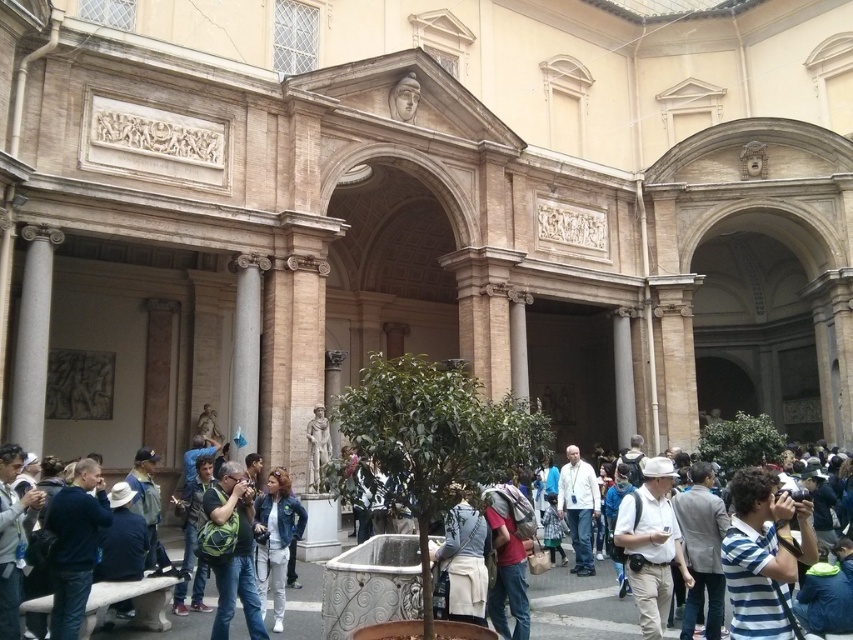
You are standing in the courtyard and want to pick up the white matte hat at center and the light gray suit at center. Which one do you need to walk towards first?

The white matte hat at center is closer to the viewer than the light gray suit at center, so you should pick up the white matte hat at center first before reaching the light gray suit at center.

You are standing in the courtyard and want to pick up both the striped cotton shirt at center and the matte green backpack at center. Which item should you reach for first to pick up the one closer to you?

The striped cotton shirt at center is closer to the viewer than the matte green backpack at center, so you should reach for the striped cotton shirt at center first.

You are standing in the courtyard and want to place a new decorative planter between the white matte hat at center and the light gray suit at center. Based on their widths, which object should the planter be placed closer to to ensure it fits properly?

The white matte hat at center might be wider than light gray suit at center, so the planter should be placed closer to the light gray suit at center to accommodate the wider width of the white matte hat at center.